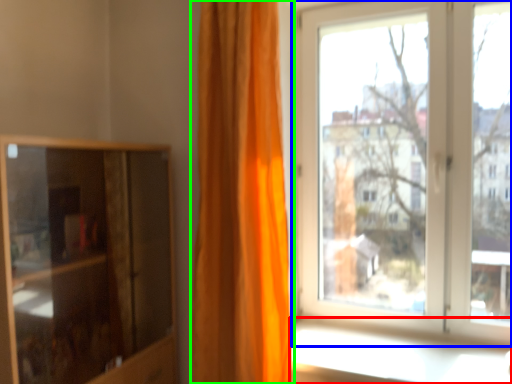
Question: Estimate the real-world distances between objects in this image. Which object is closer to window sill (highlighted by a red box), window (highlighted by a blue box) or curtain (highlighted by a green box)?

Choices:
 (A) window
 (B) curtain

Answer: (B)